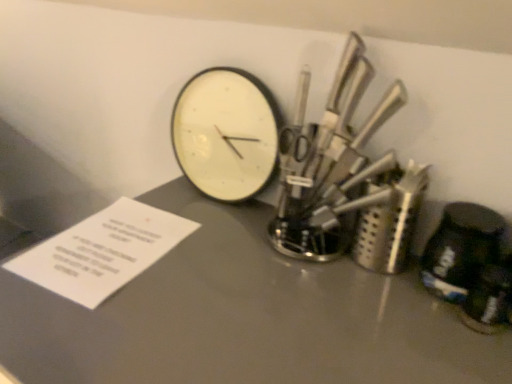
Locate an element on the screen. white paper at lower left is located at coordinates (102, 251).

The width and height of the screenshot is (512, 384). I want to click on polished metal knife set at upper right, so click(x=347, y=180).

Does point (362, 184) lie in front of point (332, 286)?

No, it is not.

How far apart are polished metal knife set at upper right and matte gray table at center?

6.69 inches.

You are a GUI agent. You are given a task and a screenshot of the screen. Output one action in this format:
    pyautogui.click(x=<x>, y=<y>)
    Task: Click on the tool above the matte gray table at center (from the image's perspective)
    Image resolution: width=512 pixels, height=384 pixels.
    Given the screenshot: What is the action you would take?
    pyautogui.click(x=347, y=180)

Can you confirm if white matte wall clock at center is taller than polished metal knife set at upper right?

Incorrect, the height of white matte wall clock at center is not larger of that of polished metal knife set at upper right.

Can you tell me how much white matte wall clock at center and polished metal knife set at upper right differ in facing direction?

There is a 0.682-degree angle between the facing directions of white matte wall clock at center and polished metal knife set at upper right.

In the image, there is a polished metal knife set at upper right. Where is `wall clock above it (from the image's perspective)`? The width and height of the screenshot is (512, 384). wall clock above it (from the image's perspective) is located at coordinates (226, 133).

From a real-world perspective, is white matte wall clock at center under polished metal knife set at upper right?

Yes, from a real-world perspective, white matte wall clock at center is beneath polished metal knife set at upper right.

I want to click on tool that appears behind the matte gray table at center, so click(347, 180).

Who is taller, matte gray table at center or polished metal knife set at upper right?

With more height is matte gray table at center.

From a real-world perspective, which object rests below the other?

matte gray table at center is physically lower.

Identify the location of tool in front of the white paper at lower left. (347, 180).

From a real-world perspective, between polished metal knife set at upper right and white paper at lower left, who is vertically lower?

white paper at lower left, from a real-world perspective.

Considering the relative sizes of polished metal knife set at upper right and white paper at lower left in the image provided, is polished metal knife set at upper right shorter than white paper at lower left?

No, polished metal knife set at upper right is not shorter than white paper at lower left.

Does polished metal knife set at upper right have a larger size compared to white paper at lower left?

Yes, polished metal knife set at upper right is bigger than white paper at lower left.

Is matte gray table at center oriented away from white matte wall clock at center?

No, matte gray table at center is not facing the opposite direction of white matte wall clock at center.

Considering the relative positions of matte gray table at center and white matte wall clock at center in the image provided, is matte gray table at center to the right of white matte wall clock at center from the viewer's perspective?

Yes.

Does matte gray table at center have a greater height compared to white matte wall clock at center?

Correct, matte gray table at center is much taller as white matte wall clock at center.

Considering the relative sizes of white matte wall clock at center and white paper at lower left in the image provided, is white matte wall clock at center wider than white paper at lower left?

No, white matte wall clock at center is not wider than white paper at lower left.

Is white paper at lower left at the back of white matte wall clock at center?

No.

From the image's perspective, which is below, white matte wall clock at center or white paper at lower left?

white paper at lower left appears lower in the image.

Between white matte wall clock at center and white paper at lower left, which one has larger size?

white matte wall clock at center.

Considering the relative positions of white paper at lower left and matte gray table at center in the image provided, is white paper at lower left to the left or to the right of matte gray table at center?

white paper at lower left is to the left of matte gray table at center.

Considering the relative sizes of white paper at lower left and matte gray table at center in the image provided, is white paper at lower left thinner than matte gray table at center?

Correct, the width of white paper at lower left is less than that of matte gray table at center.

Looking at this image, between white paper at lower left and matte gray table at center, which one is positioned behind?

white paper at lower left is further from the camera.

The height and width of the screenshot is (384, 512). Identify the location of table below the white paper at lower left (from a real-world perspective). (244, 317).

You are a GUI agent. You are given a task and a screenshot of the screen. Output one action in this format:
    pyautogui.click(x=<x>, y=<y>)
    Task: Click on the table below the polished metal knife set at upper right (from the image's perspective)
    This screenshot has height=384, width=512.
    Given the screenshot: What is the action you would take?
    pyautogui.click(x=244, y=317)

Where is `wall clock above the polished metal knife set at upper right (from the image's perspective)`? The height and width of the screenshot is (384, 512). wall clock above the polished metal knife set at upper right (from the image's perspective) is located at coordinates (226, 133).

From the picture: From the image, which object appears to be farther from matte gray table at center, white matte wall clock at center or polished metal knife set at upper right?

white matte wall clock at center is further to matte gray table at center.

Estimate the real-world distances between objects in this image. Which object is further from white paper at lower left, polished metal knife set at upper right or white matte wall clock at center?

Based on the image, polished metal knife set at upper right appears to be further to white paper at lower left.

Estimate the real-world distances between objects in this image. Which object is closer to white matte wall clock at center, white paper at lower left or matte gray table at center?

matte gray table at center is positioned closer to the anchor white matte wall clock at center.

Which object lies further to the anchor point white paper at lower left, matte gray table at center or white matte wall clock at center?

white matte wall clock at center lies further to white paper at lower left than the other object.

Based on their spatial positions, is polished metal knife set at upper right or matte gray table at center closer to white matte wall clock at center?

polished metal knife set at upper right is closer to white matte wall clock at center.

Looking at this image, from the image, which object appears to be farther from white matte wall clock at center, white paper at lower left or polished metal knife set at upper right?

white paper at lower left.

Estimate the real-world distances between objects in this image. Which object is closer to matte gray table at center, white paper at lower left or polished metal knife set at upper right?

The object closer to matte gray table at center is white paper at lower left.

Estimate the real-world distances between objects in this image. Which object is closer to polished metal knife set at upper right, matte gray table at center or white matte wall clock at center?

matte gray table at center is positioned closer to the anchor polished metal knife set at upper right.

Where is `paper between polished metal knife set at upper right and matte gray table at center in the up-down direction`? paper between polished metal knife set at upper right and matte gray table at center in the up-down direction is located at coordinates (102, 251).

Find the location of a particular element. tool that lies between white matte wall clock at center and matte gray table at center from top to bottom is located at coordinates (347, 180).

Image resolution: width=512 pixels, height=384 pixels. In order to click on paper between white matte wall clock at center and matte gray table at center vertically in this screenshot , I will do `click(102, 251)`.

The image size is (512, 384). Find the location of `wall clock located between white paper at lower left and polished metal knife set at upper right in the left-right direction`. wall clock located between white paper at lower left and polished metal knife set at upper right in the left-right direction is located at coordinates (226, 133).